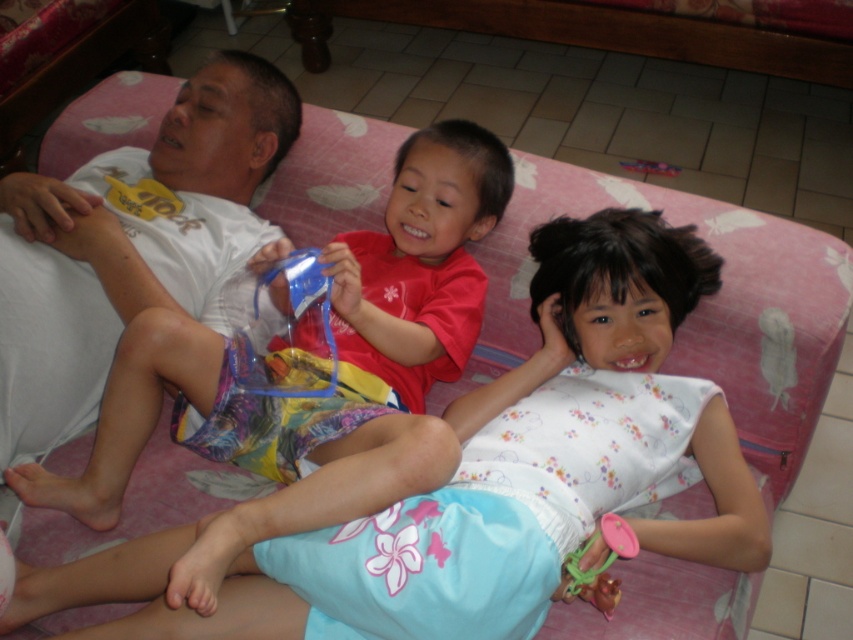
Which is in front, point (483, 388) or point (572, 561)?

Point (572, 561) is more forward.

Does floral cotton dress at center have a larger size compared to pink plastic toy at lower right?

Yes.

Is point (596, 547) less distant than point (601, 525)?

Yes, it is.

Identify the location of floral cotton dress at center. (596, 307).

Does point (125, 259) lie behind point (587, 589)?

Yes, it is behind point (587, 589).

From the picture: Is red matte shirt at center wider than pink plastic toy at lower right?

Indeed, red matte shirt at center has a greater width compared to pink plastic toy at lower right.

Locate an element on the screen. red matte shirt at center is located at coordinates (338, 358).

Describe the element at coordinates (338, 358) in the screenshot. I see `red matte shirt at center` at that location.

At what (x,y) coordinates should I click in order to perform the action: click on red matte shirt at center. Please return your answer as a coordinate pair (x, y). This screenshot has width=853, height=640. Looking at the image, I should click on (338, 358).